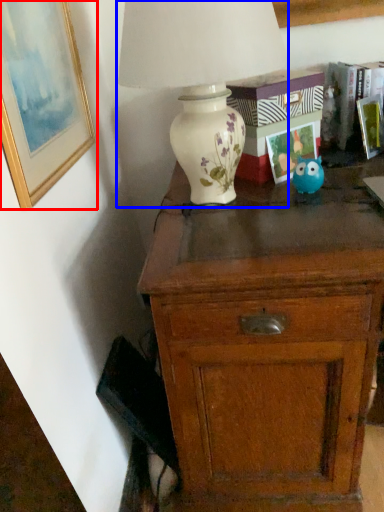
Question: Among these objects, which one is farthest to the camera, picture frame (highlighted by a red box) or lamp (highlighted by a blue box)?

Choices:
 (A) picture frame
 (B) lamp

Answer: (B)